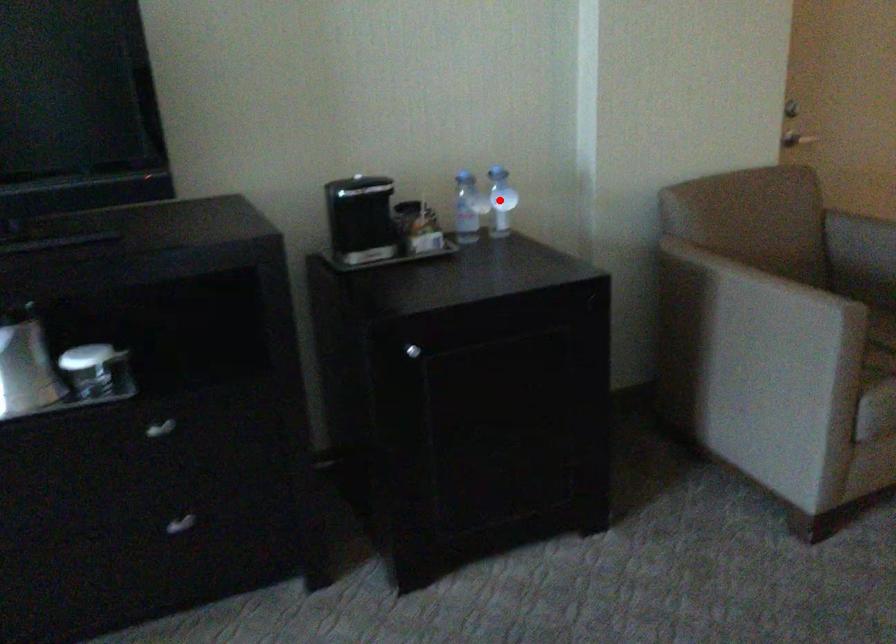
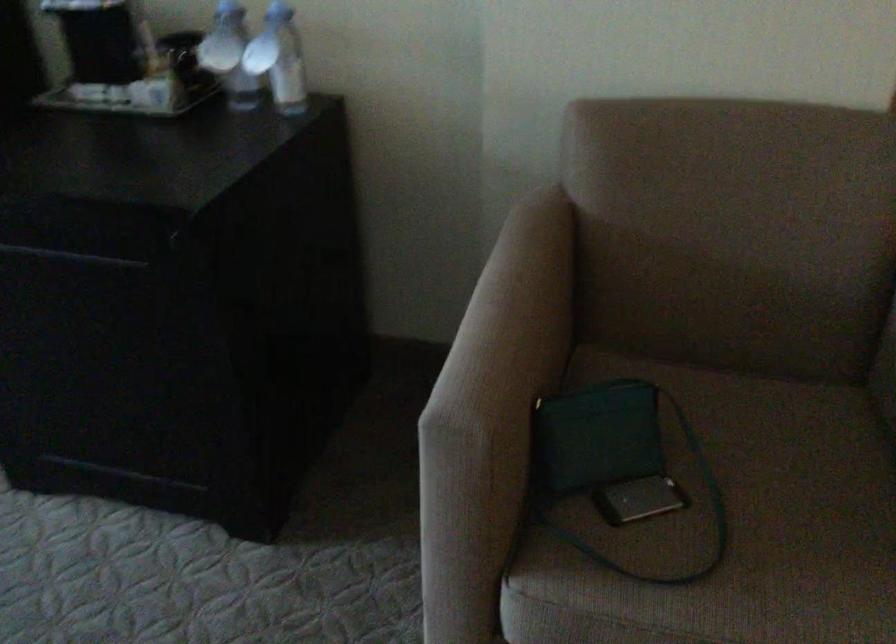
Question: I am providing you with two images of the same scene from different viewpoints. In image1, a red point is highlighted. Considering the same 3D point in image2, which of the following is correct?

Choices:
 (A) It is closer
 (B) It is farther

Answer: (A)